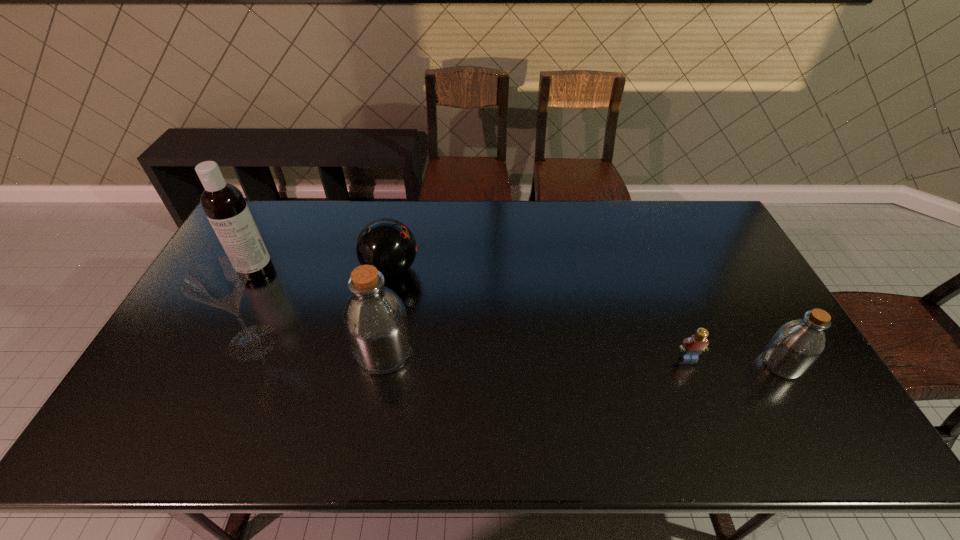
The width and height of the screenshot is (960, 540). What are the coordinates of `free location located on the label side of the dishwasher detergent` in the screenshot? It's located at (193, 391).

Find the location of a particular element. The image size is (960, 540). blank area located on the surface of the bowling ball near the finger holes is located at coordinates pyautogui.click(x=463, y=270).

The width and height of the screenshot is (960, 540). In order to click on free region located on the right of the third tallest object in this screenshot , I will do `click(356, 342)`.

Locate an element on the screen. The width and height of the screenshot is (960, 540). vacant space located 0.140m on the front-facing side of the shortest object is located at coordinates (710, 409).

Locate an element on the screen. object located in the near edge section of the desktop is located at coordinates (795, 347).

The width and height of the screenshot is (960, 540). Find the location of `dishwasher detergent that is at the left edge`. dishwasher detergent that is at the left edge is located at coordinates (224, 205).

Where is `flute glass that is at the left edge`? flute glass that is at the left edge is located at coordinates (220, 282).

Where is `object at the right edge`? Image resolution: width=960 pixels, height=540 pixels. object at the right edge is located at coordinates (795, 347).

The image size is (960, 540). I want to click on object that is at the near right corner, so click(x=795, y=347).

Locate an element on the screen. The height and width of the screenshot is (540, 960). vacant area at the far edge of the desktop is located at coordinates (420, 214).